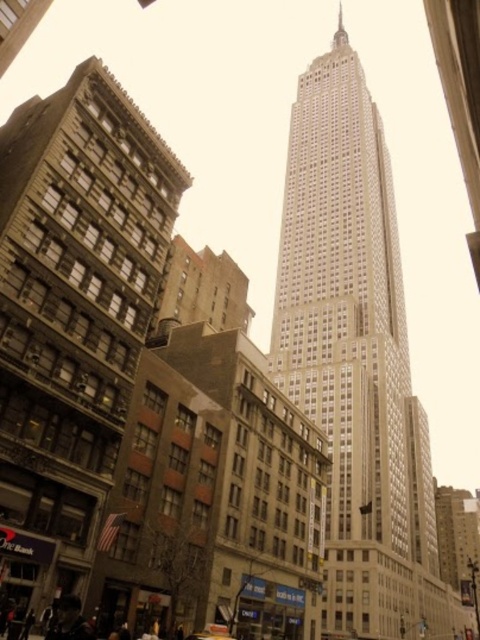
You are a delivery person standing at the metallic silver car at center. You need to deliver a package to the brown stone building at left. The delivery robot you have can only travel up to 30 meters. Can the robot make the delivery?

The distance between the brown stone building at left and the metallic silver car at center is 28.39 meters, so yes, the delivery robot can make the delivery since it is within its 30 meters range.

From the picture: You are a photographer standing in the middle of the street, facing the Empire State Building. You want to take a photo that includes both the brown stone building at left and the metallic silver car at center. Which object should you frame wider in your camera to capture its full width?

The brown stone building at left should be framed wider because its width surpasses that of the metallic silver car at center.

You are standing on the sidewalk and see the beige stone tower at center and the metallic silver car at center. Which object is closer to you?

The beige stone tower at center is closer to you because it is further to the viewer than the metallic silver car at center.